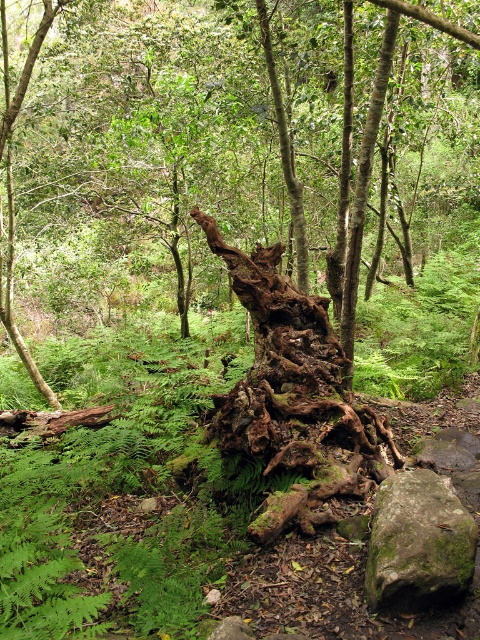
Measure the distance between rusty wood log at center and camera.

They are 5.34 feet apart.

Between rusty wood log at center and rusty wood tree trunk at center, which one has more height?

With more height is rusty wood log at center.

I want to click on rusty wood log at center, so click(241, 172).

At what (x,y) coordinates should I click in order to perform the action: click on rusty wood log at center. Please return your answer as a coordinate pair (x, y). This screenshot has width=480, height=640. Looking at the image, I should click on (241, 172).

Between rusty wood log at center and green mossy rock at lower right, which one has less height?

With less height is green mossy rock at lower right.

Which is more to the left, rusty wood log at center or green mossy rock at lower right?

rusty wood log at center

This screenshot has width=480, height=640. Describe the element at coordinates (241, 172) in the screenshot. I see `rusty wood log at center` at that location.

Find the location of a particular element. rusty wood log at center is located at coordinates (241, 172).

Does rusty wood tree trunk at center appear under green mossy rock at lower right?

Incorrect, rusty wood tree trunk at center is not positioned below green mossy rock at lower right.

Consider the image. Is rusty wood tree trunk at center to the right of green mossy rock at lower right from the viewer's perspective?

Incorrect, rusty wood tree trunk at center is not on the right side of green mossy rock at lower right.

Between point (292, 368) and point (419, 477), which one is positioned behind?

The point (292, 368) is more distant.

Identify the location of rusty wood tree trunk at center. (292, 394).